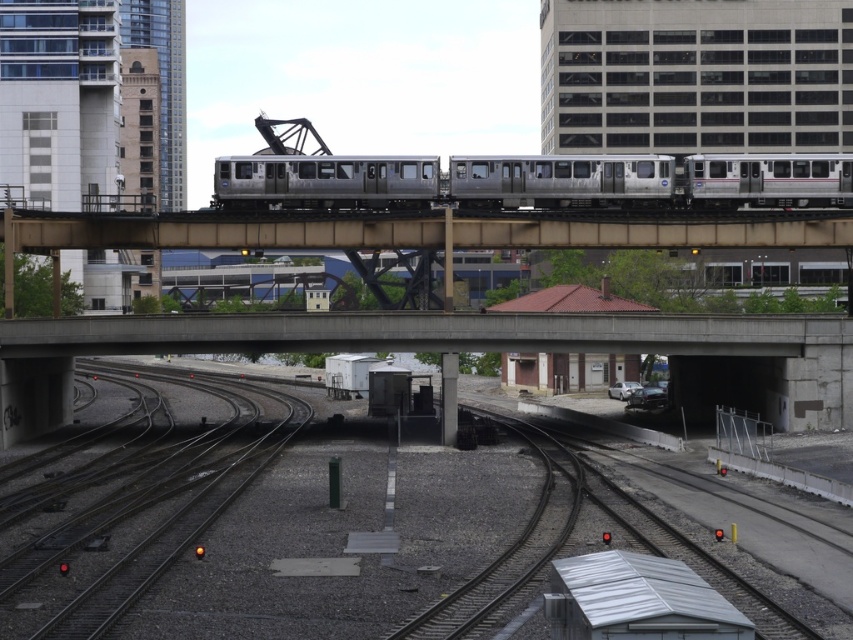
Question: Does smooth concrete tracks at center come in front of dark gray metal tracks at lower left?

Choices:
 (A) no
 (B) yes

Answer: (A)

Question: Does concrete bridge at center appear on the left side of dark gray metal tracks at lower left?

Choices:
 (A) no
 (B) yes

Answer: (A)

Question: Among these objects, which one is nearest to the camera?

Choices:
 (A) dark gray metal tracks at lower left
 (B) concrete bridge at center
 (C) silver metallic train at center

Answer: (A)

Question: Does smooth concrete tracks at center have a larger size compared to silver metallic train at center?

Choices:
 (A) no
 (B) yes

Answer: (B)

Question: Which is farther from the dark gray metal tracks at lower left?

Choices:
 (A) silver metallic train at center
 (B) concrete bridge at center
 (C) smooth concrete tracks at center

Answer: (A)

Question: Which of these objects is positioned farthest from the dark gray metal tracks at lower left?

Choices:
 (A) smooth concrete tracks at center
 (B) concrete bridge at center

Answer: (B)